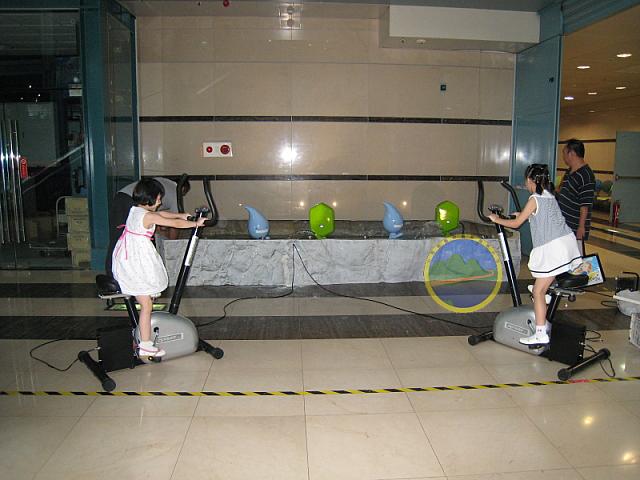
Where is `recessed ceiling lgiht`? The height and width of the screenshot is (480, 640). recessed ceiling lgiht is located at coordinates (585, 70), (625, 57), (620, 89), (591, 95), (568, 100).